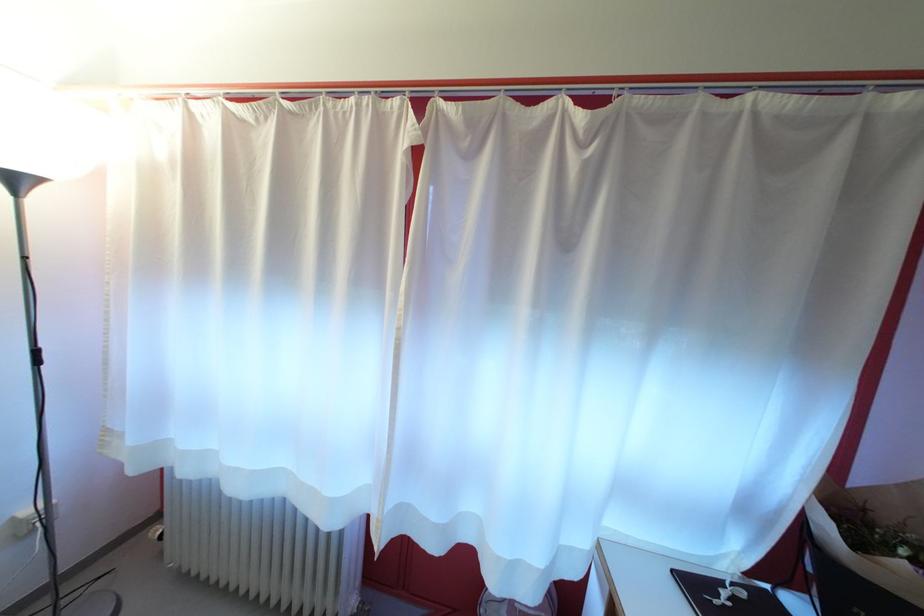
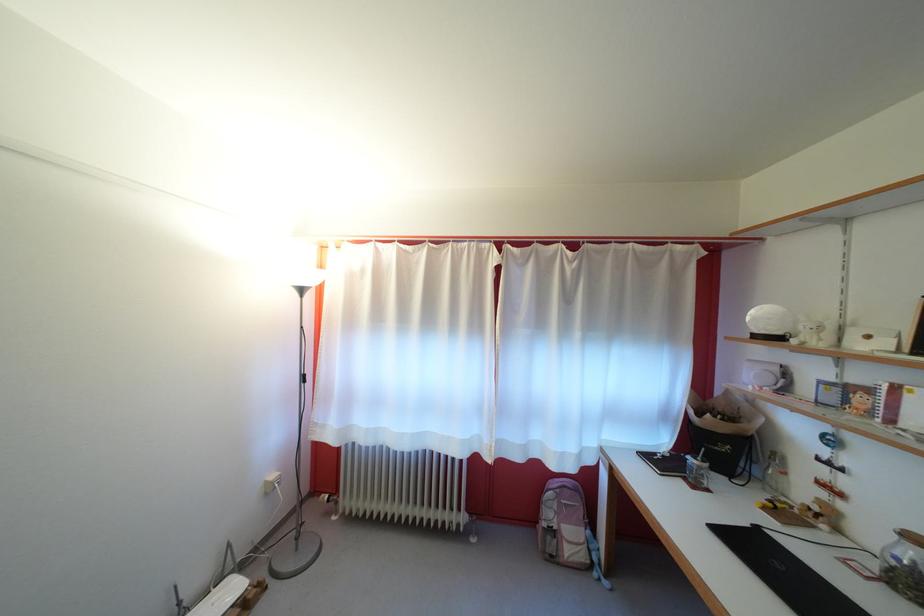
What movement of the cameraman would produce the second image?

The cameraman moved toward left, backward.